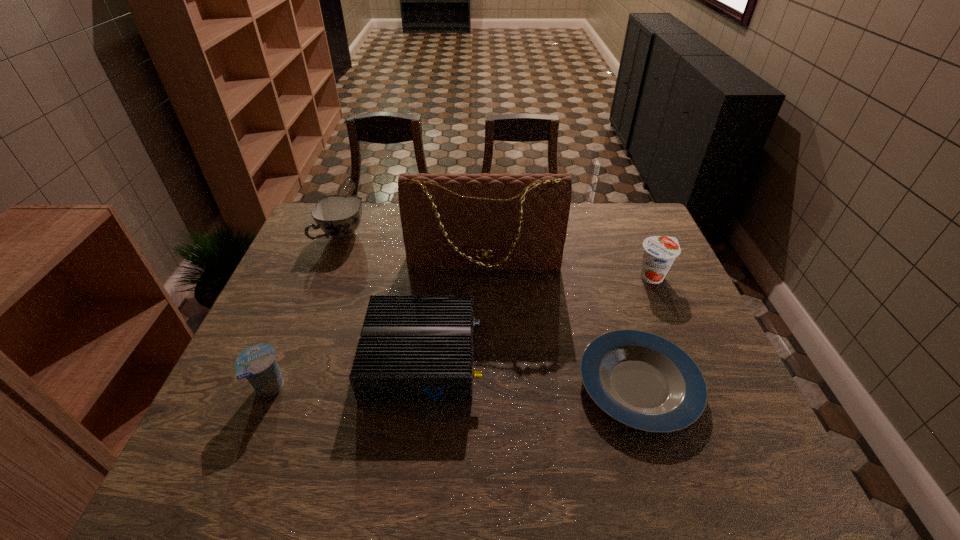
You are a GUI agent. You are given a task and a screenshot of the screen. Output one action in this format:
    pyautogui.click(x=<x>, y=<y>)
    Task: Click on the tallest object
    This screenshot has width=960, height=540.
    Given the screenshot: What is the action you would take?
    click(463, 221)

Locate an element on the screen. chinaware is located at coordinates (339, 216).

At what (x,y) coordinates should I click in order to perform the action: click on the farther yogurt. Please return your answer as a coordinate pair (x, y). The height and width of the screenshot is (540, 960). Looking at the image, I should click on (659, 253).

Locate an element on the screen. This screenshot has width=960, height=540. the left yogurt is located at coordinates (257, 363).

The height and width of the screenshot is (540, 960). Identify the location of router. (412, 347).

This screenshot has width=960, height=540. Find the location of `the shortest object`. the shortest object is located at coordinates (644, 381).

Where is `vacant area located 0.080m on the front-facing side of the handbag`? Image resolution: width=960 pixels, height=540 pixels. vacant area located 0.080m on the front-facing side of the handbag is located at coordinates (485, 299).

Locate an element on the screen. The width and height of the screenshot is (960, 540). free space located on the right of the chinaware is located at coordinates (399, 236).

The width and height of the screenshot is (960, 540). What are the coordinates of `blank area located on the back of the farther yogurt` in the screenshot? It's located at (636, 238).

Locate an element on the screen. Image resolution: width=960 pixels, height=540 pixels. free region located on the front of the left yogurt is located at coordinates (245, 450).